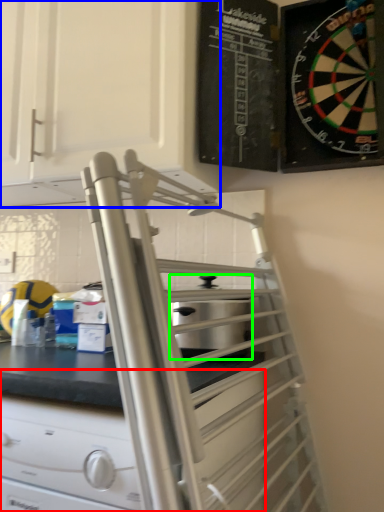
Question: Based on their relative distances, which object is nearer to drawer (highlighted by a red box)? Choose from cabinetry (highlighted by a blue box) and appliance (highlighted by a green box).

Choices:
 (A) cabinetry
 (B) appliance

Answer: (B)